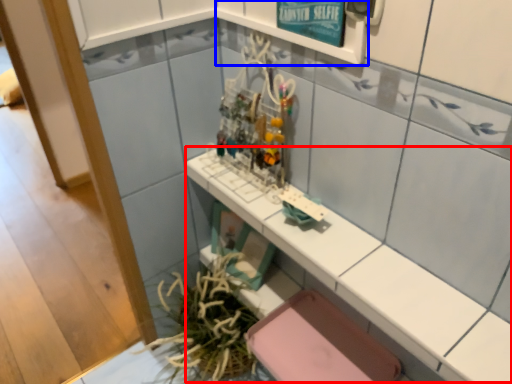
Question: Which point is closer to the camera, counter top (highlighted by a red box) or shelf (highlighted by a blue box)?

Choices:
 (A) counter top
 (B) shelf

Answer: (A)